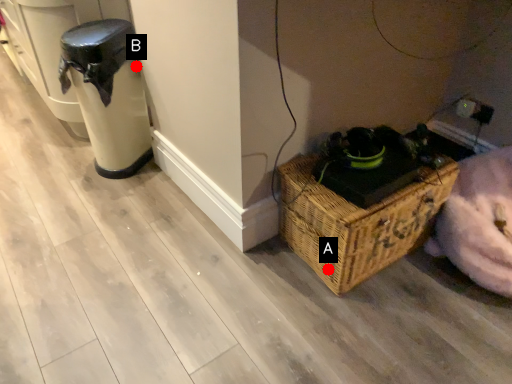
Question: Two points are circled on the image, labeled by A and B beside each circle. Which point is farther from the camera taking this photo?

Choices:
 (A) A is further
 (B) B is further

Answer: (B)